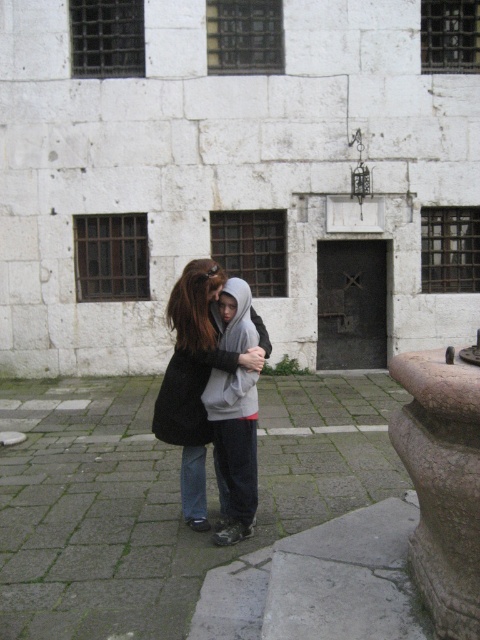
Consider the image. You are standing at point (194, 280) and want to walk to point (445, 454). Based on the scene, is there a clear path between these two points?

Yes, there is a clear path between point (445, 454) and point (194, 280) since point (445, 454) is in front of point (194, 280), indicating they are along the same line of sight without obstructions.

You are a photographer trying to capture both the brown stone pillar at lower right and the dark gray hoodie at center in the same frame. Based on their positions, which object is located to the right side of the other?

The brown stone pillar at lower right is located to the right of the dark gray hoodie at center.

You are standing in front of the weathered stone building with barred windows. You notice a point at coordinates [443,483]. What object is located at that point?

The point at coordinates [443,483] corresponds to the brown stone pillar at lower right.